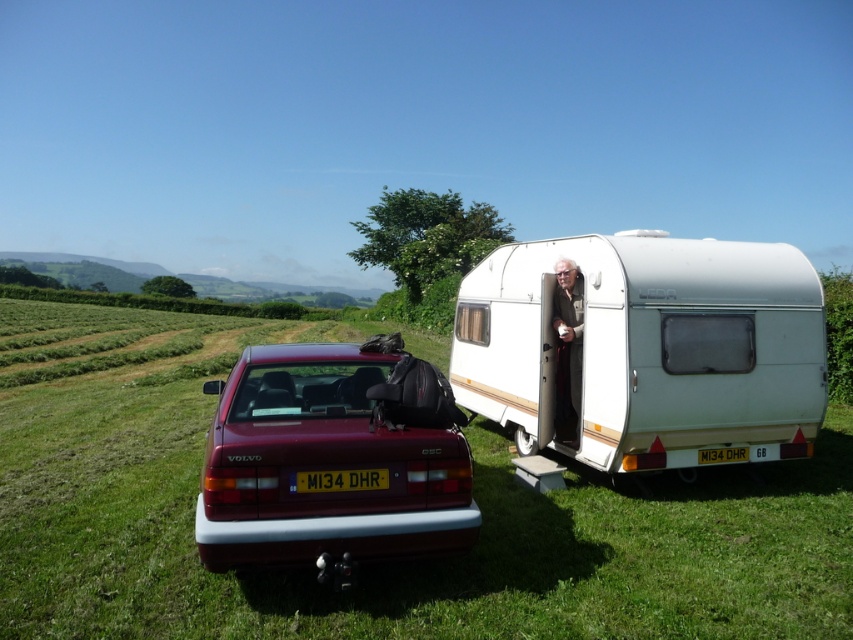
Can you confirm if light brown leather jacket at center is wider than white plastic license plate at center?

In fact, light brown leather jacket at center might be narrower than white plastic license plate at center.

Is light brown leather jacket at center thinner than white plastic license plate at center?

Yes, light brown leather jacket at center is thinner than white plastic license plate at center.

Does point (564, 262) come farther from viewer compared to point (723, 456)?

Yes, it is.

Where is `light brown leather jacket at center`? This screenshot has width=853, height=640. light brown leather jacket at center is located at coordinates (567, 349).

Which is more to the left, shiny maroon car at center or white plastic license plate at center?

From the viewer's perspective, shiny maroon car at center appears more on the left side.

Does shiny maroon car at center appear under white plastic license plate at center?

No, shiny maroon car at center is not below white plastic license plate at center.

Is point (363, 532) closer to viewer compared to point (711, 458)?

Yes, it is.

The height and width of the screenshot is (640, 853). In order to click on shiny maroon car at center in this screenshot , I will do `click(323, 467)`.

Locate an element on the screen. This screenshot has width=853, height=640. green grassy field at center is located at coordinates (378, 564).

Which is in front, point (850, 468) or point (704, 458)?

Point (704, 458) is more forward.

Between point (221, 369) and point (744, 460), which one is positioned behind?

Point (221, 369)

You are a GUI agent. You are given a task and a screenshot of the screen. Output one action in this format:
    pyautogui.click(x=<x>, y=<y>)
    Task: Click on the green grassy field at center
    
    Given the screenshot: What is the action you would take?
    pyautogui.click(x=378, y=564)